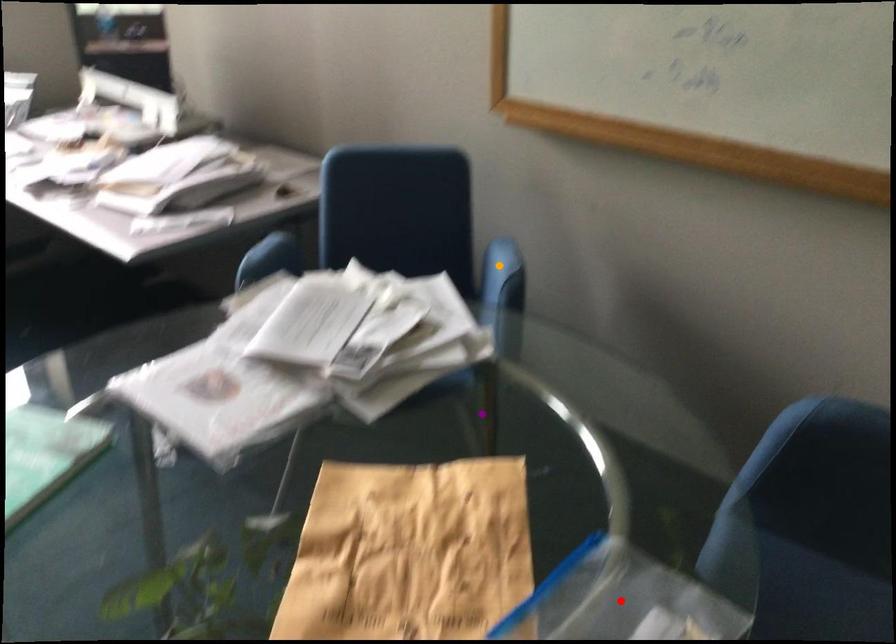
Order these from nearest to farthest:
1. purple point
2. red point
3. orange point

red point
orange point
purple point